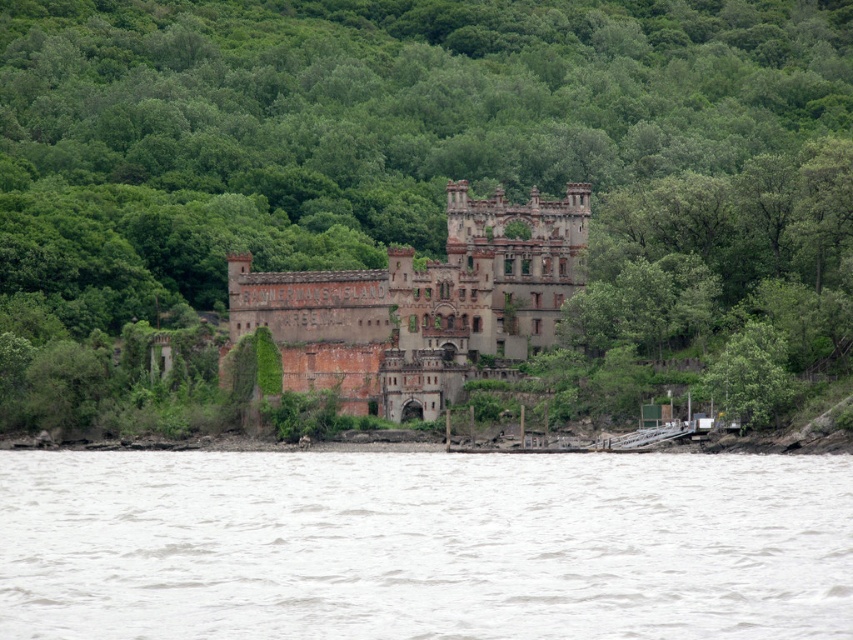
You are a park ranger planning to install a safety barrier between the green leafy tree at center and the rusty brick castle at center. The barrier requires a minimum of 10 meters of space between the tree and the castle to be effective. Based on the scene, will the current distance suffice?

The green leafy tree at center is 10.92 meters from the rusty brick castle at center, which exceeds the required 10 meters, so the barrier will be effective.

You are a painter who wants to capture the scene of the dilapidated castle. You notice the green leafy tree at center and the gray water at lower center. Which object should you paint first if you want to follow the rule of focusing on the larger elements first?

The green leafy tree at center should be painted first because it has a larger size compared to the gray water at lower center.

You are a drone operator trying to capture the rusty brick castle at center from above. You notice the gray water at lower center might interfere with your shot. Based on the scene, which object occupies more area in the image?

The rusty brick castle at center occupies a larger area compared to the gray water at lower center because the gray water at lower center has a smaller size according to the description.